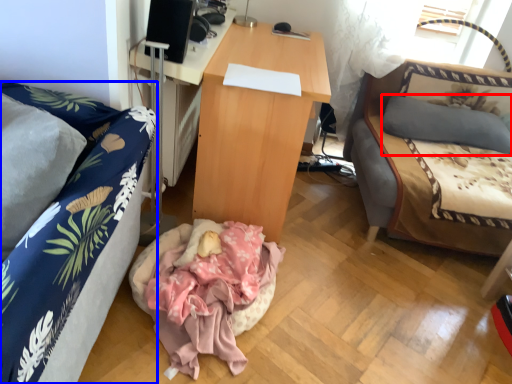
Question: Among these objects, which one is farthest to the camera, pillow (highlighted by a red box) or studio couch (highlighted by a blue box)?

Choices:
 (A) pillow
 (B) studio couch

Answer: (A)